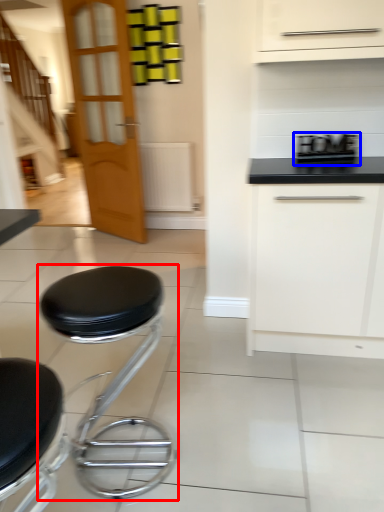
Question: Which of the following is the closest to the observer, stool (highlighted by a red box) or appliance (highlighted by a blue box)?

Choices:
 (A) stool
 (B) appliance

Answer: (A)